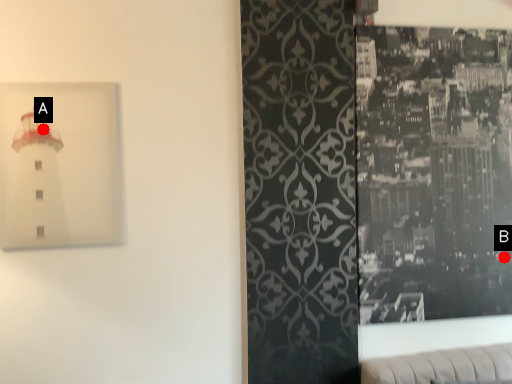
Question: Two points are circled on the image, labeled by A and B beside each circle. Which point is closer to the camera taking this photo?

Choices:
 (A) A is closer
 (B) B is closer

Answer: (A)